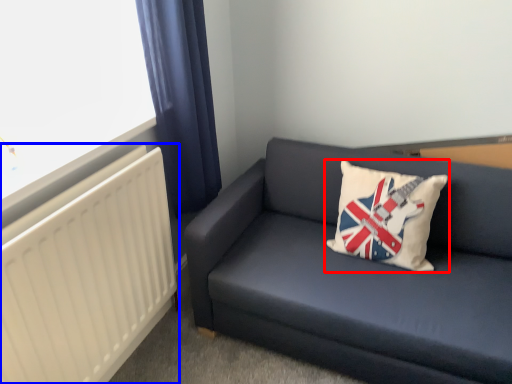
Question: Among these objects, which one is farthest to the camera, pillow (highlighted by a red box) or radiator (highlighted by a blue box)?

Choices:
 (A) pillow
 (B) radiator

Answer: (A)